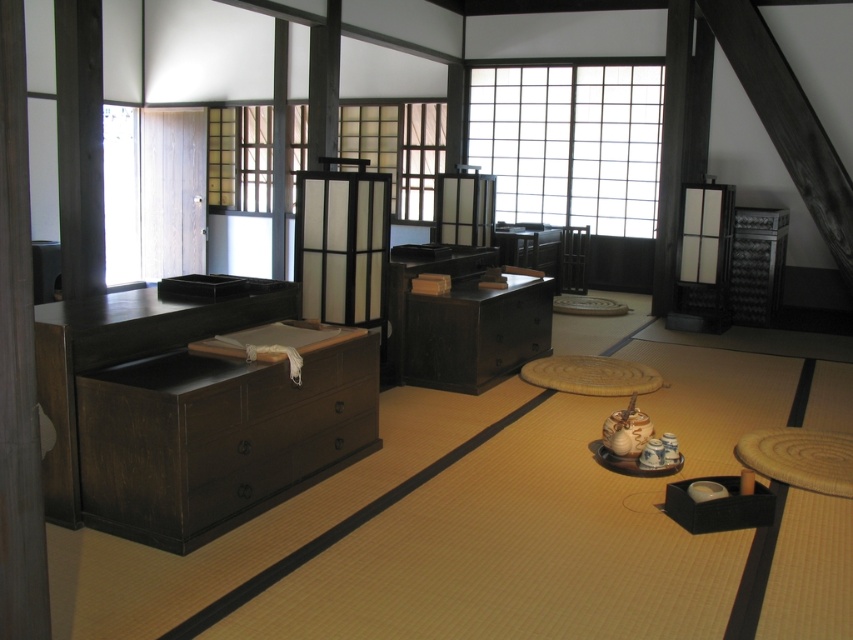
Question: Is dark wood dresser at left in front of dark wood table at center?

Choices:
 (A) yes
 (B) no

Answer: (A)

Question: Is dark wood dresser at left to the right of dark wood table at center from the viewer's perspective?

Choices:
 (A) no
 (B) yes

Answer: (A)

Question: Is dark wood dresser at left to the left of dark wood table at center from the viewer's perspective?

Choices:
 (A) yes
 (B) no

Answer: (A)

Question: Among these objects, which one is farthest from the camera?

Choices:
 (A) dark wood table at center
 (B) dark wood dresser at left

Answer: (A)

Question: Which of the following is the closest to the observer?

Choices:
 (A) dark wood table at center
 (B) dark wood dresser at left

Answer: (B)